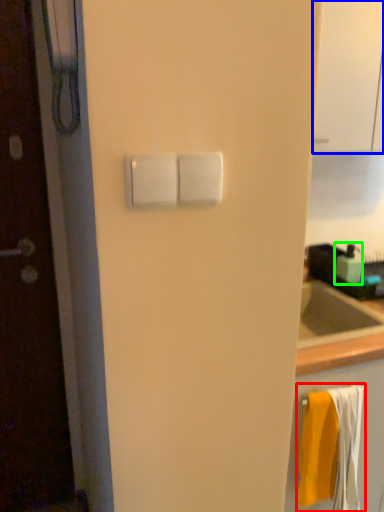
Question: Considering the real-world distances, which object is closest to bath towel (highlighted by a red box)? glass door (highlighted by a blue box) or soap dispenser (highlighted by a green box).

Choices:
 (A) glass door
 (B) soap dispenser

Answer: (B)